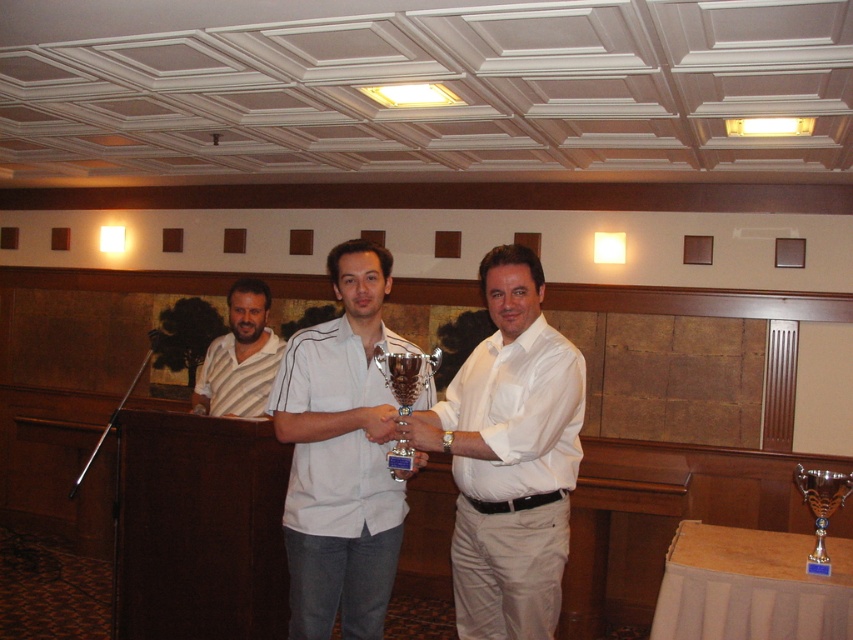
You are a photographer standing in the room and want to take a picture of the white glossy shirt at center and the silver metallic trophy at lower right. Can you fit both subjects in the frame if your camera has a 4.5 feet wide field of view?

The distance between the white glossy shirt at center and the silver metallic trophy at lower right is 4.55 feet. Since the camera can only capture 4.5 feet in width, the two subjects are slightly too far apart to fit within the frame.

You are a photographer at the event and want to take a photo of the silver metallic trophy at lower right without the white glossy shirt at center blocking it. What should you do?

Move the camera position to the left or right so that the white glossy shirt at center is no longer in front of the silver metallic trophy at lower right.